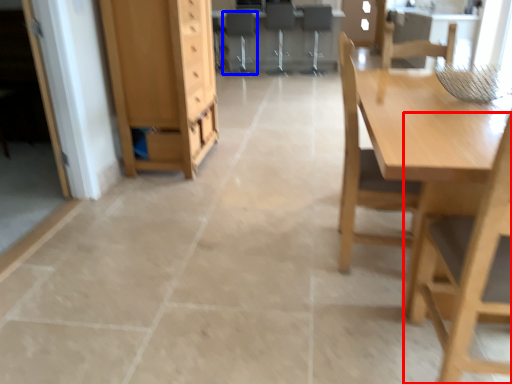
Question: Which point is further to the camera, chair (highlighted by a red box) or chair (highlighted by a blue box)?

Choices:
 (A) chair
 (B) chair

Answer: (B)